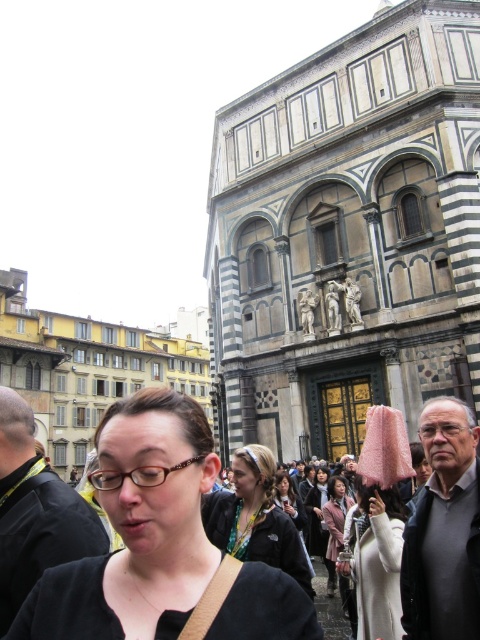
Between point (308, 600) and point (474, 497), which one is positioned in front?

Point (308, 600) is in front.

Does matte black glasses at center have a lesser width compared to gray wool sweater at lower right?

No.

Locate an element on the screen. Image resolution: width=480 pixels, height=640 pixels. matte black glasses at center is located at coordinates (160, 545).

This screenshot has height=640, width=480. What are the coordinates of `matte black glasses at center` in the screenshot? It's located at (160, 545).

Is point (402, 580) closer to viewer compared to point (290, 484)?

Yes.

Which is above, gray wool sweater at lower right or matte black hair at center?

Positioned higher is gray wool sweater at lower right.

What do you see at coordinates (444, 531) in the screenshot?
I see `gray wool sweater at lower right` at bounding box center [444, 531].

At what (x,y) coordinates should I click in order to perform the action: click on gray wool sweater at lower right. Please return your answer as a coordinate pair (x, y). Looking at the image, I should click on (444, 531).

Is gray wool sweater at lower right closer to the viewer compared to light brown fabric coat at center?

Yes, it is in front of light brown fabric coat at center.

Can you confirm if gray wool sweater at lower right is positioned to the right of light brown fabric coat at center?

Indeed, gray wool sweater at lower right is positioned on the right side of light brown fabric coat at center.

Which is in front, point (474, 440) or point (334, 588)?

Point (474, 440) is in front.

Locate an element on the screen. This screenshot has height=640, width=480. gray wool sweater at lower right is located at coordinates (444, 531).